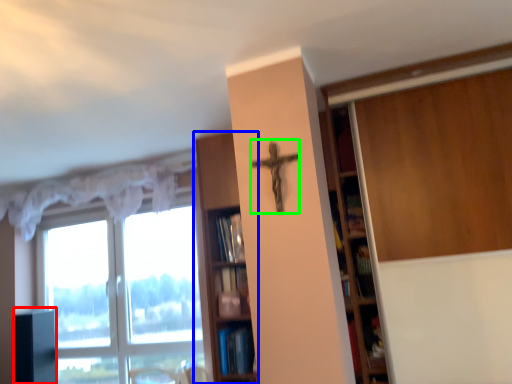
Question: Considering the real-world distances, which object is closest to cabinetry (highlighted by a red box)? shelf (highlighted by a blue box) or crucifix (highlighted by a green box).

Choices:
 (A) shelf
 (B) crucifix

Answer: (A)